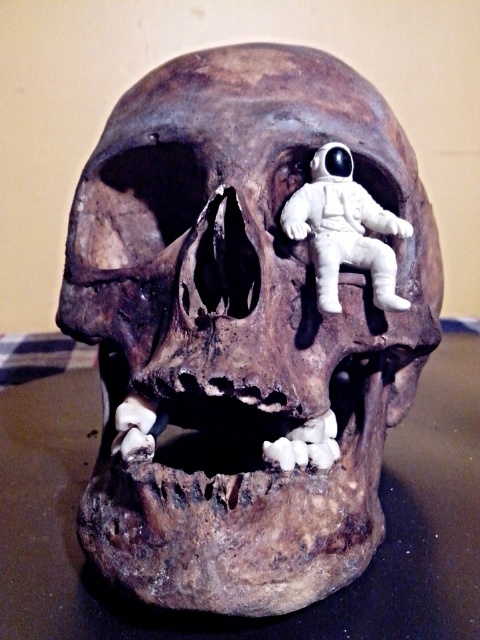
You are an artist trying to sketch this scene. You need to determine which of the two points, point (349, 621) or point (334, 228), should be drawn first to maintain proper perspective. Based on their positions, which point is closer to you?

Point (349, 621) is closer to the viewer than point (334, 228), so you should draw point (349, 621) first to maintain proper perspective.

You are an artist trying to place a small decorative item on a shelf. You have a brown matte skull at center and a white matte astronaut at upper center. If you want to ensure both items can fit side by side on a shelf that is only slightly wider than the skull, which item should you place first to maximize space?

Since the brown matte skull at center might be wider than the white matte astronaut at upper center, you should place the brown matte skull at center first to ensure both items can fit side by side on the shelf.

You are an archaeologist examining the black matte skull at center and the white matte astronaut at upper center. Which object has a greater width?

The black matte skull at center has a greater width than the white matte astronaut at upper center.